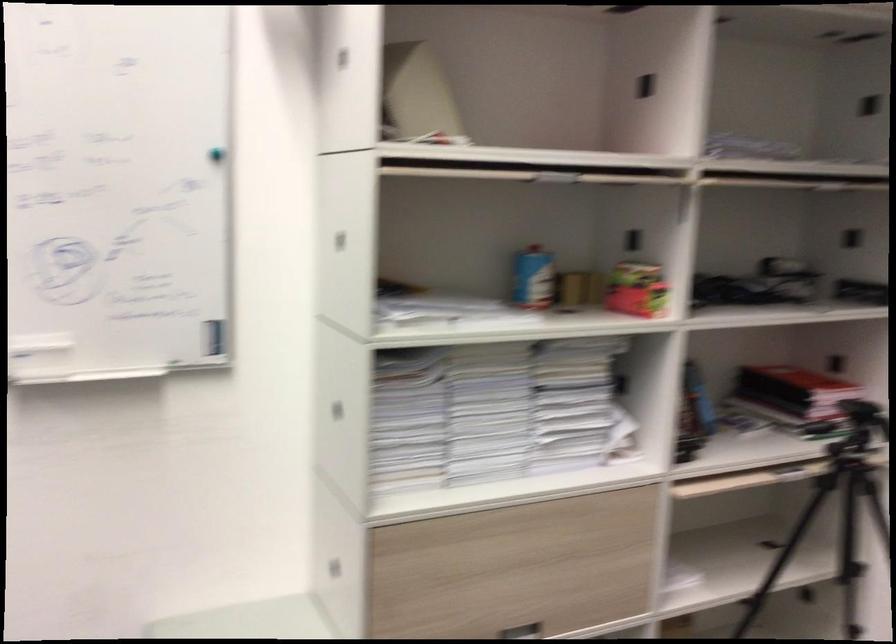
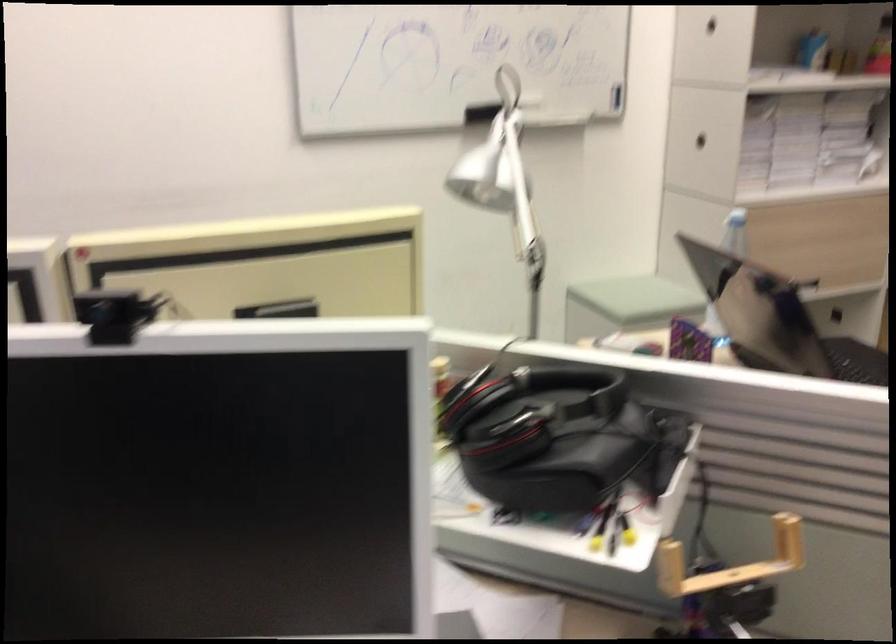
Locate, in the second image, the point that corresponds to [332,415] in the first image.

(700, 140)